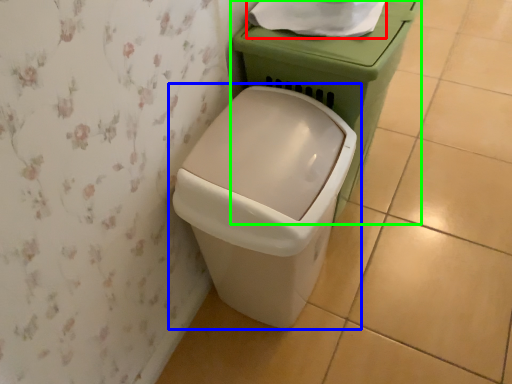
Question: Based on their relative distances, which object is nearer to toilet paper (highlighted by a red box)? Choose from waste container (highlighted by a blue box) and porcelain (highlighted by a green box).

Choices:
 (A) waste container
 (B) porcelain

Answer: (B)